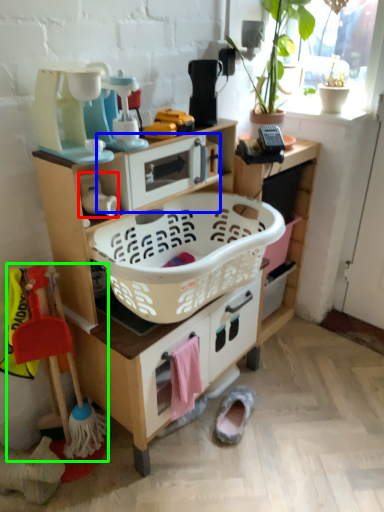
Question: Which object is positioned closest to toy (highlighted by a red box)? Select from appliance (highlighted by a blue box) and toy (highlighted by a green box).

Choices:
 (A) appliance
 (B) toy

Answer: (A)